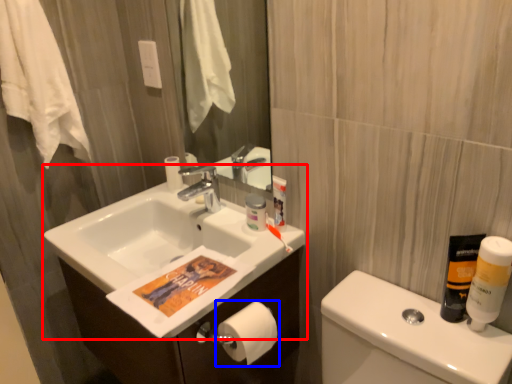
Question: Which of the following is the closest to the observer, sink (highlighted by a red box) or toilet paper (highlighted by a blue box)?

Choices:
 (A) sink
 (B) toilet paper

Answer: (A)